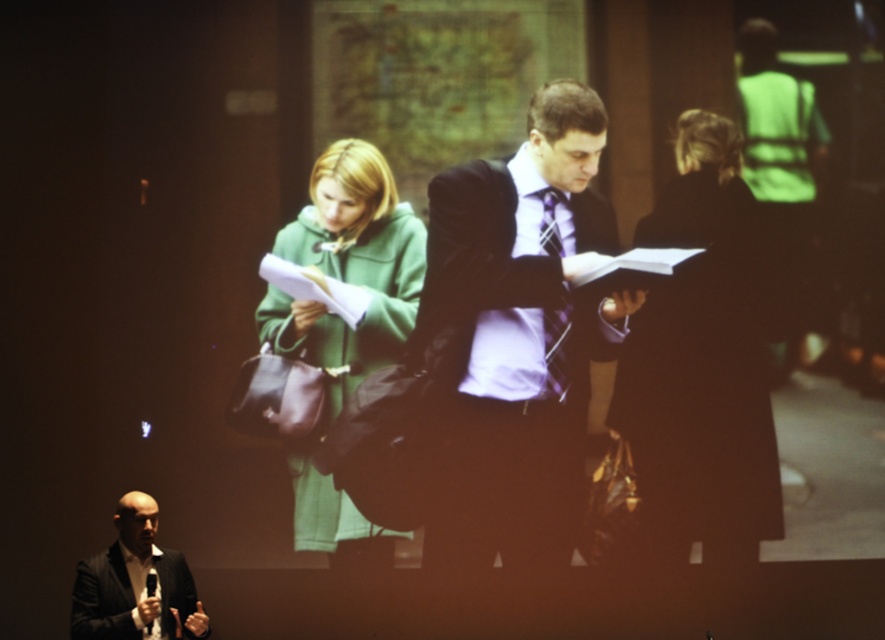
Does green matte coat at center have a lesser height compared to purple silk tie at center?

No, green matte coat at center is not shorter than purple silk tie at center.

Does green matte coat at center lie in front of purple silk tie at center?

That is True.

Between point (329, 292) and point (558, 369), which one is positioned behind?

The point (558, 369) is more distant.

Where is `green matte coat at center`? green matte coat at center is located at coordinates (347, 273).

Does matte black suit at center have a lesser height compared to purple silk tie at center?

No.

Which is in front, point (521, 556) or point (544, 236)?

Point (521, 556) is in front.

Does point (485, 550) come closer to viewer compared to point (558, 339)?

Yes, it is.

Locate an element on the screen. This screenshot has height=640, width=885. matte black suit at center is located at coordinates (516, 337).

Can you confirm if matte black suit at center is thinner than matte black suit at lower left?

Incorrect, matte black suit at center's width is not less than matte black suit at lower left's.

Which is in front, point (564, 144) or point (135, 492)?

Point (135, 492)

Locate an element on the screen. This screenshot has width=885, height=640. matte black suit at center is located at coordinates (516, 337).